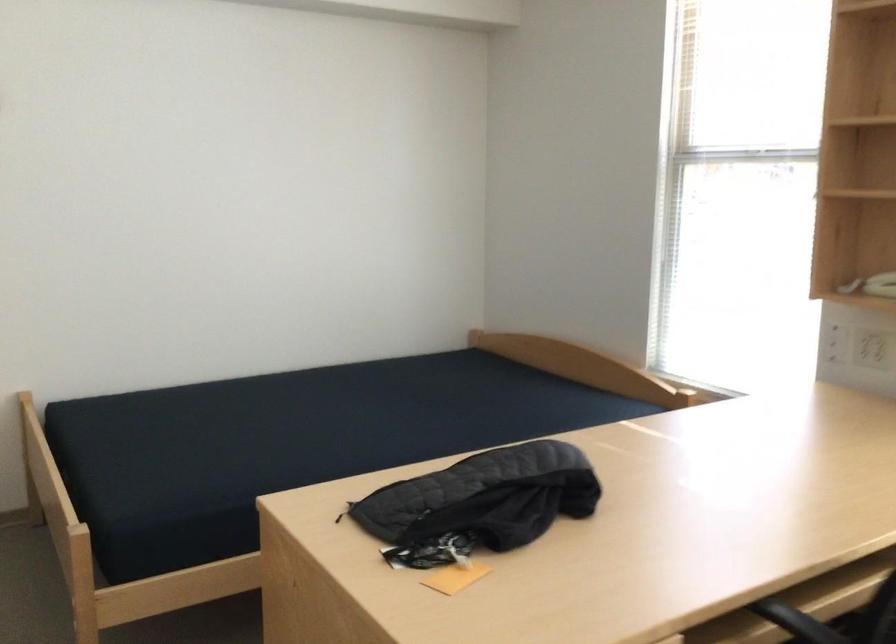
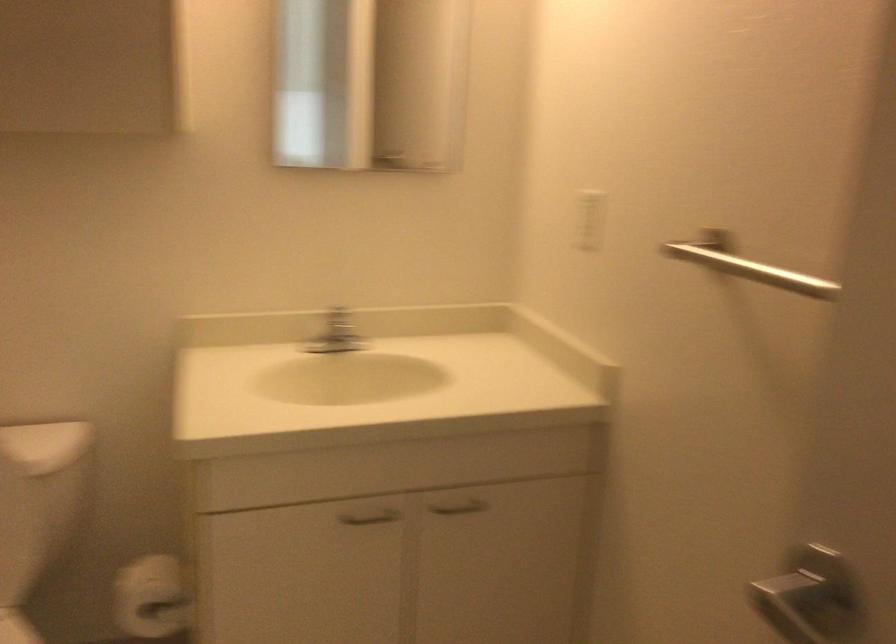
Question: Which direction would the cameraman need to move to produce the second image? Reply with the corresponding letter.

Choices:
 (A) Left
 (B) Right
 (C) Forward
 (D) Backward

Answer: (A)